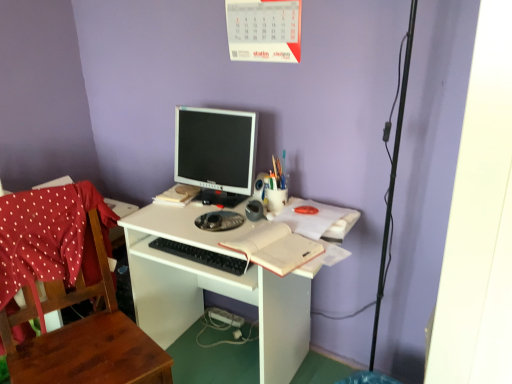
Where is `black plastic keyboard at center`? black plastic keyboard at center is located at coordinates (201, 256).

What is the approximate width of matte black monitor at center?

The width of matte black monitor at center is 17.04 centimeters.

Identify the location of matte black monitor at center. The width and height of the screenshot is (512, 384). (216, 149).

What do you see at coordinates (214, 287) in the screenshot? Image resolution: width=512 pixels, height=384 pixels. I see `white matte desk at center` at bounding box center [214, 287].

This screenshot has width=512, height=384. What do you see at coordinates (278, 173) in the screenshot?
I see `multicolored plastic pen holder at center` at bounding box center [278, 173].

Identify the location of black plastic keyboard at center. (201, 256).

In the scene shown: How many degrees apart are the facing directions of multicolored plastic pen holder at center and black plastic keyboard at center?

The angle between the facing direction of multicolored plastic pen holder at center and the facing direction of black plastic keyboard at center is 2.9 degrees.

In order to click on stationery behind the black plastic keyboard at center in this screenshot , I will do `click(278, 173)`.

Does multicolored plastic pen holder at center appear on the right side of black plastic keyboard at center?

Yes, multicolored plastic pen holder at center is to the right of black plastic keyboard at center.

Does multicolored plastic pen holder at center come in front of black plastic keyboard at center?

No.

Between black plastic keyboard at center and matte black monitor at center, which one has larger width?

Wider between the two is matte black monitor at center.

Is point (209, 257) closer or farther from the camera than point (202, 120)?

Point (209, 257) appears to be closer to the viewer than point (202, 120).

Is black plastic keyboard at center to the left or to the right of matte black monitor at center in the image?

black plastic keyboard at center is to the left of matte black monitor at center.

Is black plastic keyboard at center aimed at matte black monitor at center?

No, black plastic keyboard at center is not facing towards matte black monitor at center.

Is wooden chair at left oriented away from multicolored plastic pen holder at center?

wooden chair at left does not have its back to multicolored plastic pen holder at center.

Can you confirm if wooden chair at left is wider than multicolored plastic pen holder at center?

Indeed, wooden chair at left has a greater width compared to multicolored plastic pen holder at center.

From the image's perspective, is wooden chair at left on top of multicolored plastic pen holder at center?

Incorrect, from the image's perspective, wooden chair at left is lower than multicolored plastic pen holder at center.

Can you confirm if wooden chair at left is smaller than multicolored plastic pen holder at center?

No.

Considering the positions of objects black plastic keyboard at center and white matte notebook at center in the image provided, who is behind, black plastic keyboard at center or white matte notebook at center?

black plastic keyboard at center is further from the camera.

Can you confirm if black plastic keyboard at center is thinner than white matte notebook at center?

Yes, black plastic keyboard at center is thinner than white matte notebook at center.

You are a GUI agent. You are given a task and a screenshot of the screen. Output one action in this format:
    pyautogui.click(x=<x>, y=<y>)
    Task: Click on the computer keyboard behind the white matte notebook at center
    
    Given the screenshot: What is the action you would take?
    pyautogui.click(x=201, y=256)

Is black plastic keyboard at center in contact with white matte notebook at center?

black plastic keyboard at center and white matte notebook at center are not in contact.

At what (x,y) coordinates should I click in order to perform the action: click on desk in front of the matte black monitor at center. Please return your answer as a coordinate pair (x, y). The image size is (512, 384). Looking at the image, I should click on (214, 287).

Could you tell me if white matte desk at center is facing matte black monitor at center?

No, white matte desk at center does not turn towards matte black monitor at center.

Does point (260, 282) come behind point (210, 148)?

No.

Would you say white matte desk at center is a long distance from matte black monitor at center?

No, white matte desk at center is not far from matte black monitor at center.

Is matte black monitor at center at the left side of wooden chair at left?

No.

Is matte black monitor at center inside the boundaries of wooden chair at left, or outside?

matte black monitor at center is not inside wooden chair at left, it's outside.

From a real-world perspective, is matte black monitor at center physically located above or below wooden chair at left?

matte black monitor at center is above wooden chair at left.

Is point (244, 167) closer or farther from the camera than point (58, 251)?

Point (244, 167) appears to be farther away from the viewer than point (58, 251).

Would you say white matte desk at center is outside wooden chair at left?

Yes.

From the image's perspective, is white matte desk at center beneath wooden chair at left?

No, from the image's perspective, white matte desk at center is not beneath wooden chair at left.

Considering the positions of objects white matte desk at center and wooden chair at left in the image provided, who is more to the left, white matte desk at center or wooden chair at left?

From the viewer's perspective, wooden chair at left appears more on the left side.

Where is `stationery above the black plastic keyboard at center (from the image's perspective)`? Image resolution: width=512 pixels, height=384 pixels. stationery above the black plastic keyboard at center (from the image's perspective) is located at coordinates (278, 173).

The height and width of the screenshot is (384, 512). What are the coordinates of `computer monitor above the black plastic keyboard at center (from a real-world perspective)` in the screenshot? It's located at (216, 149).

When comparing their distances from matte black monitor at center, does white matte notebook at center or black plastic keyboard at center seem further?

Based on the image, white matte notebook at center appears to be further to matte black monitor at center.

Based on their spatial positions, is white matte notebook at center or matte black monitor at center closer to white matte desk at center?

white matte notebook at center is closer to white matte desk at center.

Based on their spatial positions, is black plastic keyboard at center or multicolored plastic pen holder at center further from wooden chair at left?

multicolored plastic pen holder at center is positioned further to the anchor wooden chair at left.

Looking at the image, which one is located further to matte black monitor at center, black plastic keyboard at center or wooden chair at left?

Based on the image, wooden chair at left appears to be further to matte black monitor at center.

Estimate the real-world distances between objects in this image. Which object is further from black plastic keyboard at center, white matte notebook at center or multicolored plastic pen holder at center?

multicolored plastic pen holder at center is positioned further to the anchor black plastic keyboard at center.

From the image, which object appears to be farther from white matte notebook at center, wooden chair at left or black plastic keyboard at center?

Among the two, wooden chair at left is located further to white matte notebook at center.

Which object lies nearer to the anchor point white matte notebook at center, white matte desk at center or wooden chair at left?

The object closer to white matte notebook at center is white matte desk at center.

Which object lies further to the anchor point matte black monitor at center, wooden chair at left or white matte desk at center?

wooden chair at left is positioned further to the anchor matte black monitor at center.

Identify the location of computer keyboard between matte black monitor at center and white matte desk at center from top to bottom. (201, 256).

Identify the location of stationery between matte black monitor at center and black plastic keyboard at center in the up-down direction. (278, 173).

Where is `computer monitor located between wooden chair at left and white matte notebook at center in the left-right direction`? computer monitor located between wooden chair at left and white matte notebook at center in the left-right direction is located at coordinates (216, 149).

Where is `computer keyboard between wooden chair at left and multicolored plastic pen holder at center along the z-axis`? The height and width of the screenshot is (384, 512). computer keyboard between wooden chair at left and multicolored plastic pen holder at center along the z-axis is located at coordinates [201, 256].